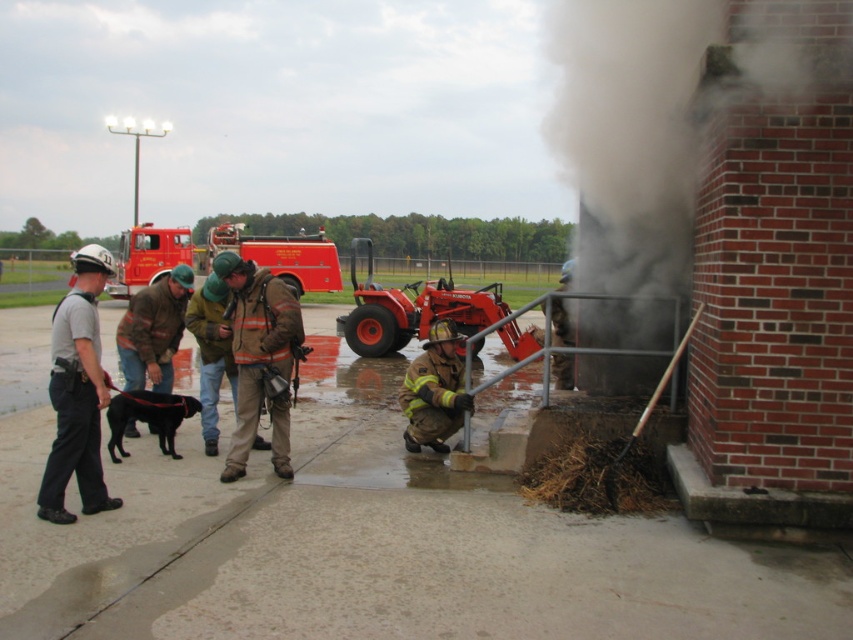
You are a photographer taking pictures of the firefighters. You notice the brown fuzzy jacket at left and the firefighter uniform at lower center in your frame. Which piece of clothing appears taller in the photo?

The firefighter uniform at lower center appears taller because it is taller than the brown fuzzy jacket at left.

You are a photographer at the fire training site. You need to capture a photo of the gray uniform at left and the firefighter uniform at lower center. Which uniform should you focus on to ensure it fits entirely within the camera frame if your current frame can only accommodate the width of the narrower uniform?

The firefighter uniform at lower center has a smaller width than the gray uniform at left. Therefore, to ensure it fits entirely within the camera frame, focus on the firefighter uniform at lower center.